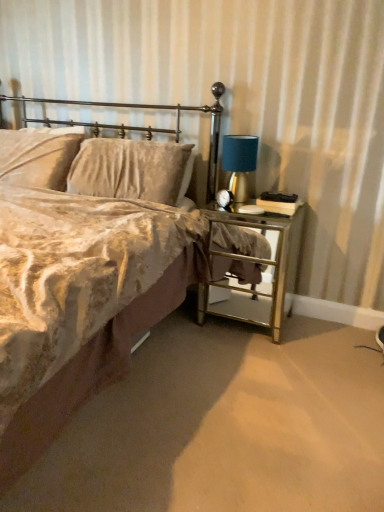
Question: From the image's perspective, is blue fabric lampshade at right below gold mirrored nightstand at right?

Choices:
 (A) no
 (B) yes

Answer: (A)

Question: Is blue fabric lampshade at right wider than gold mirrored nightstand at right?

Choices:
 (A) no
 (B) yes

Answer: (A)

Question: Is blue fabric lampshade at right closer to camera compared to gold mirrored nightstand at right?

Choices:
 (A) yes
 (B) no

Answer: (B)

Question: Is blue fabric lampshade at right oriented towards gold mirrored nightstand at right?

Choices:
 (A) no
 (B) yes

Answer: (A)

Question: Is blue fabric lampshade at right completely or partially outside of gold mirrored nightstand at right?

Choices:
 (A) yes
 (B) no

Answer: (A)

Question: Is gold mirrored nightstand at right situated inside velvet beige bed at center or outside?

Choices:
 (A) inside
 (B) outside

Answer: (B)

Question: Based on their sizes in the image, would you say gold mirrored nightstand at right is bigger or smaller than velvet beige bed at center?

Choices:
 (A) small
 (B) big

Answer: (A)

Question: Visually, is gold mirrored nightstand at right positioned to the left or to the right of velvet beige bed at center?

Choices:
 (A) right
 (B) left

Answer: (A)

Question: From the image's perspective, is gold mirrored nightstand at right above or below velvet beige bed at center?

Choices:
 (A) below
 (B) above

Answer: (A)

Question: Is point (236, 152) positioned closer to the camera than point (6, 98)?

Choices:
 (A) farther
 (B) closer

Answer: (B)

Question: Visually, is blue fabric lampshade at right positioned to the left or to the right of metallic gold headboard at upper left?

Choices:
 (A) left
 (B) right

Answer: (B)

Question: In the image, is blue fabric lampshade at right positioned in front of or behind metallic gold headboard at upper left?

Choices:
 (A) behind
 (B) front

Answer: (A)

Question: Considering the positions of blue fabric lampshade at right and metallic gold headboard at upper left in the image, is blue fabric lampshade at right taller or shorter than metallic gold headboard at upper left?

Choices:
 (A) tall
 (B) short

Answer: (B)

Question: Considering the positions of velvet beige bed at center and blue fabric lampshade at right in the image, is velvet beige bed at center wider or thinner than blue fabric lampshade at right?

Choices:
 (A) thin
 (B) wide

Answer: (B)

Question: Do you think velvet beige bed at center is within blue fabric lampshade at right, or outside of it?

Choices:
 (A) outside
 (B) inside

Answer: (A)